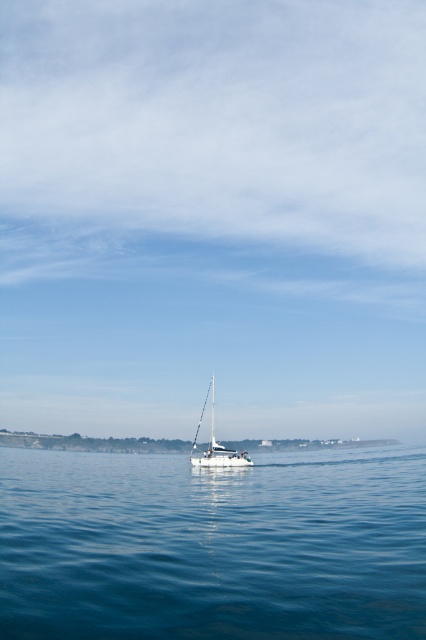
You are an observer standing on the shore looking out at the blue liquid water at center and the white glossy sailboat at center. Which object is wider from your viewpoint?

The blue liquid water at center is wider than the white glossy sailboat at center according to the description.

In the scene shown: You are standing on a cliff overlooking the seascape. You see the blue liquid water at center and the white glossy sailboat at center. Which object is positioned to the right of the other?

The blue liquid water at center is to the right of the white glossy sailboat at center.